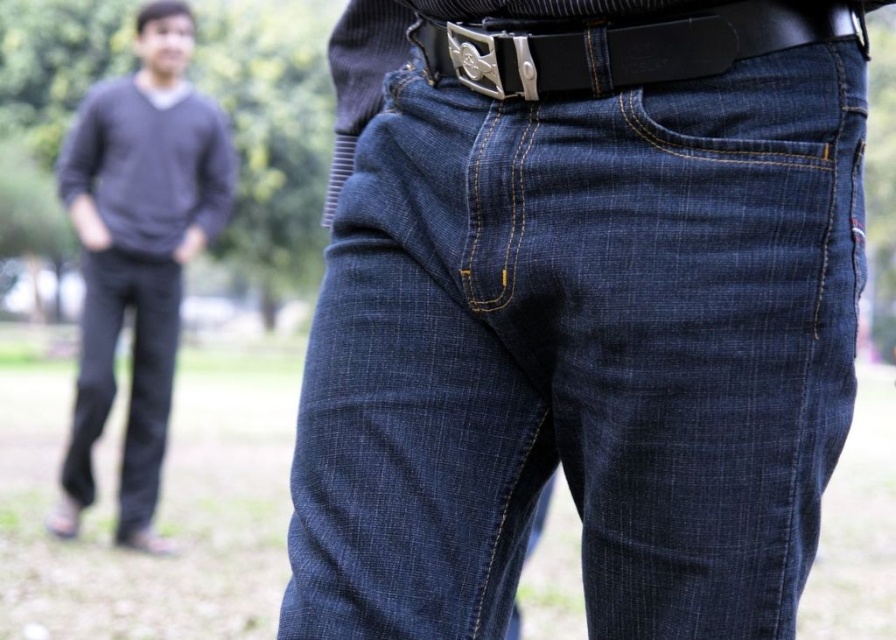
You are a photographer planning to take a portrait of the person wearing the dark gray sweater at upper left and the dark blue denim jeans at lower left. To ensure both subjects are in focus, you need to know their relative positions. Which object is located to the right of the other?

The dark gray sweater at upper left is positioned on the right side of the dark blue denim jeans at lower left, so the dark gray sweater at upper left is to the right of the dark blue denim jeans at lower left.

You are a photographer trying to capture a candid shot of the person wearing the dark gray sweater at upper left and the dark blue denim jeans at lower left. Since the subjects are partially overlapping, which clothing item should you focus on to ensure the other remains in the background?

You should focus on the dark gray sweater at upper left because it is in front of the dark blue denim jeans at lower left, so the jeans will naturally be in the background if the sweater is the main focus.

You are standing at the location of the person wearing dark blue jeans and a black belt with a silver buckle. You want to hand a small note to the person wearing the dark gray sweater at upper left. Can you reach them without moving from your current position?

The distance between the person wearing dark blue jeans and a black belt with a silver buckle and the person wearing dark gray sweater at upper left is 4.51 meters. Since the distance is too far to reach without moving, you cannot hand the note directly from your current position.